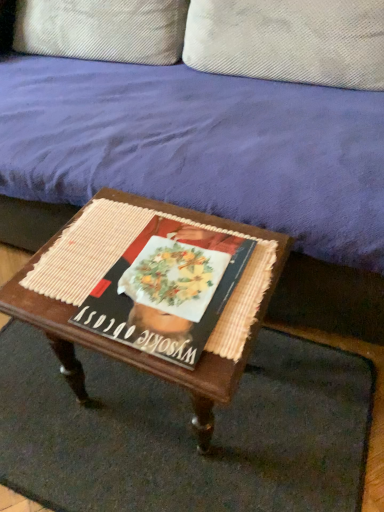
You are a GUI agent. You are given a task and a screenshot of the screen. Output one action in this format:
    pyautogui.click(x=<x>, y=<y>)
    Task: Click on the free space above woven wood table at center (from a real-world perspective)
    
    Given the screenshot: What is the action you would take?
    pyautogui.click(x=147, y=262)